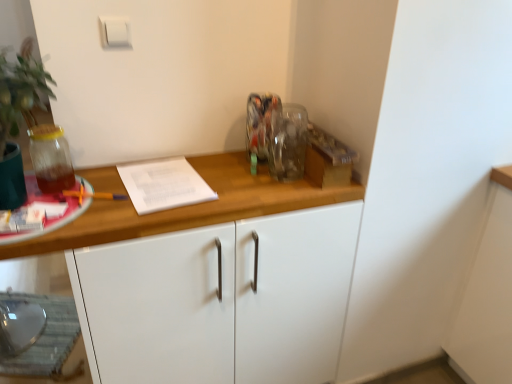
Question: In terms of height, does white plastic light switch at upper center look taller or shorter compared to translucent glass jar at left?

Choices:
 (A) tall
 (B) short

Answer: (B)

Question: Is point (114, 18) closer or farther from the camera than point (53, 163)?

Choices:
 (A) farther
 (B) closer

Answer: (A)

Question: Considering the real-world distances, which object is farthest from the translucent glass jar at left?

Choices:
 (A) white matte cabinet at center
 (B) white plastic light switch at upper center

Answer: (A)

Question: Estimate the real-world distances between objects in this image. Which object is closer to the white plastic light switch at upper center?

Choices:
 (A) translucent glass jar at left
 (B) white matte cabinet at center

Answer: (A)